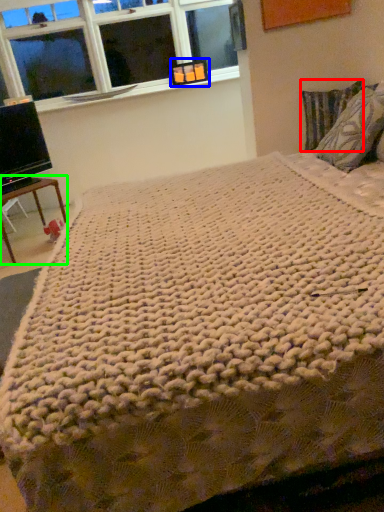
Question: Based on their relative distances, which object is farther from pillow (highlighted by a red box)? Choose from picture frame (highlighted by a blue box) and table (highlighted by a green box).

Choices:
 (A) picture frame
 (B) table

Answer: (B)